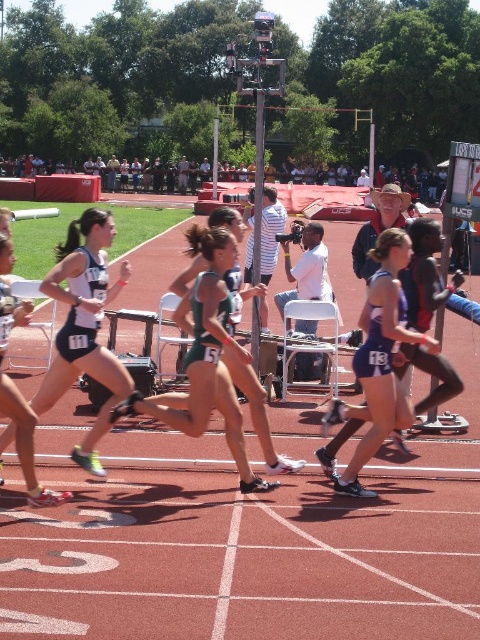
Can you confirm if red rubber track at center is bigger than blue athletic uniform at center?

Indeed, red rubber track at center has a larger size compared to blue athletic uniform at center.

Is point (96, 624) positioned after point (376, 426)?

That is False.

Which is behind, point (231, 545) or point (408, 410)?

The point (408, 410) is more distant.

This screenshot has width=480, height=640. I want to click on red rubber track at center, so click(x=240, y=541).

Is red rubber track at center further to the viewer compared to matte black shorts at center?

No, red rubber track at center is closer to the viewer.

The width and height of the screenshot is (480, 640). In order to click on red rubber track at center in this screenshot , I will do `click(240, 541)`.

Between point (436, 625) and point (95, 280), which one is positioned behind?

The point (95, 280) is more distant.

Where is `red rubber track at center`? The width and height of the screenshot is (480, 640). red rubber track at center is located at coordinates (240, 541).

Is point (106, 285) positioned in front of point (180, 305)?

Yes, it is in front of point (180, 305).

Is matte black shorts at center positioned before green athletic uniform at center?

No, it is behind green athletic uniform at center.

This screenshot has width=480, height=640. Identify the location of matte black shorts at center. (84, 324).

You are a GUI agent. You are given a task and a screenshot of the screen. Output one action in this format:
    pyautogui.click(x=<x>, y=<y>)
    Task: Click on the matte black shorts at center
    
    Given the screenshot: What is the action you would take?
    pyautogui.click(x=84, y=324)